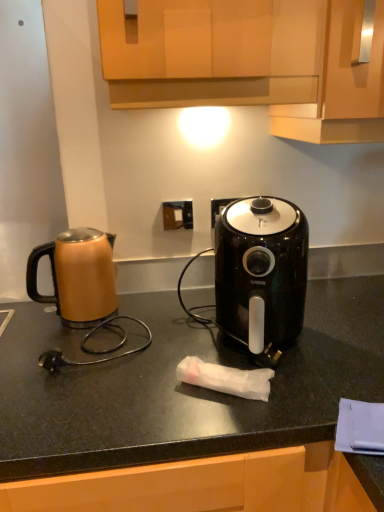
At what (x,y) coordinates should I click in order to perform the action: click on blank area beneath wooden cabinet at upper center, the second cabinetry from the left (from a real-world perspective). Please return your answer as a coordinate pair (x, y). Image resolution: width=384 pixels, height=512 pixels. Looking at the image, I should click on (350, 312).